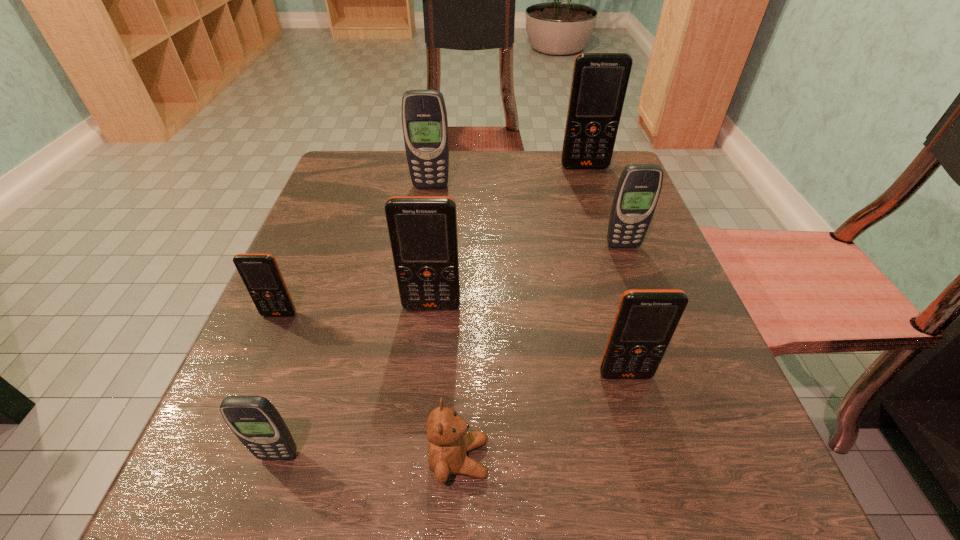
Where is `the biggest orange cellular telephone`? This screenshot has width=960, height=540. the biggest orange cellular telephone is located at coordinates (599, 83).

Where is `the tallest object`? The height and width of the screenshot is (540, 960). the tallest object is located at coordinates tap(599, 83).

The image size is (960, 540). I want to click on the third smallest orange cellular telephone, so click(422, 229).

This screenshot has width=960, height=540. I want to click on the sixth nearest cellular telephone, so click(424, 117).

The image size is (960, 540). Find the location of `the farthest gray cellular telephone`. the farthest gray cellular telephone is located at coordinates (424, 117).

Find the location of a particular element. The width and height of the screenshot is (960, 540). the third farthest cellular telephone is located at coordinates (638, 189).

Image resolution: width=960 pixels, height=540 pixels. I want to click on the rightmost gray cellular telephone, so click(638, 189).

I want to click on the nearest orange cellular telephone, so click(x=646, y=319).

Where is `the second smallest orange cellular telephone`? the second smallest orange cellular telephone is located at coordinates (646, 319).

Locate an element on the screen. The height and width of the screenshot is (540, 960). the leftmost object is located at coordinates (260, 273).